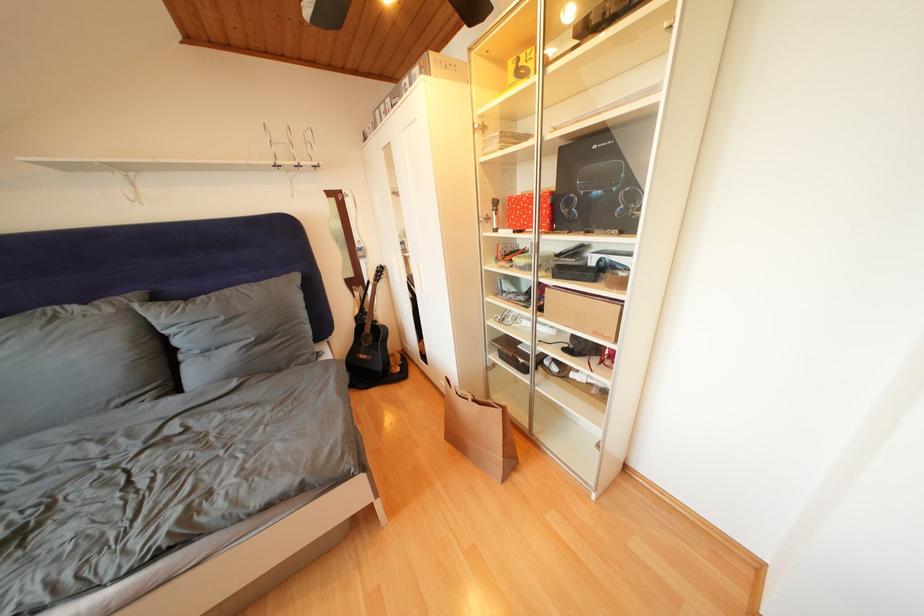
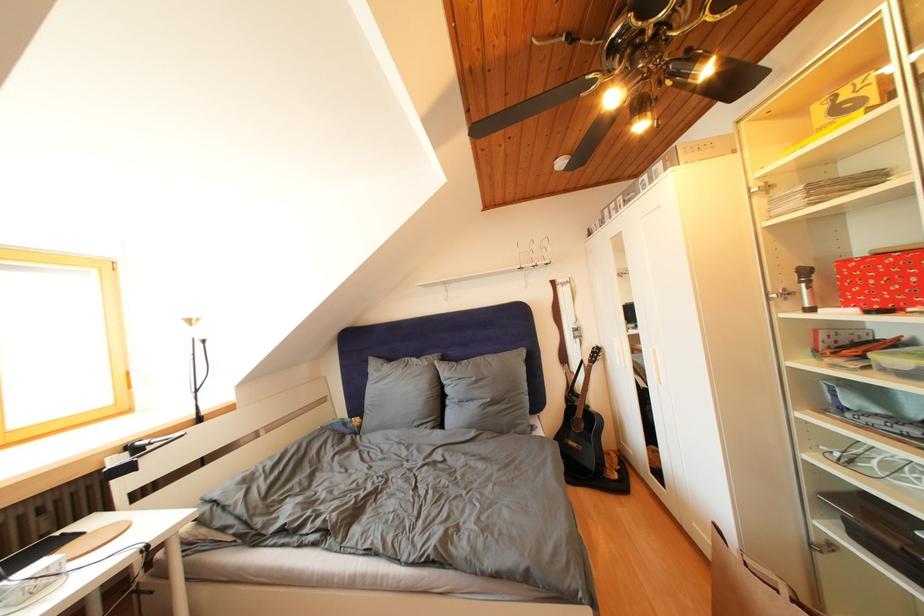
Question: The camera is either moving clockwise (left) or counter-clockwise (right) around the object. The first image is from the beginning of the video and the second image is from the end. Is the camera moving left or right when shooting the video?

Choices:
 (A) Left
 (B) Right

Answer: (B)